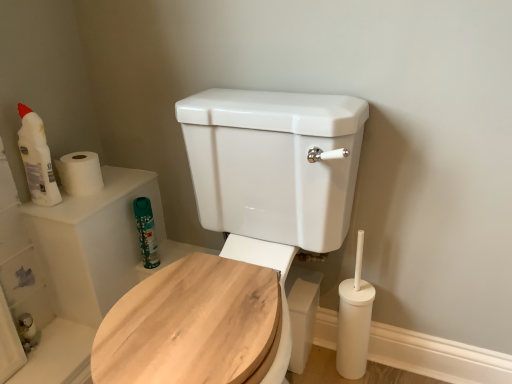
Question: From a real-world perspective, is matte white bottle at upper left, placed as the 2th cleaning product when sorted from right to left, below white matte toilet paper at upper left?

Choices:
 (A) yes
 (B) no

Answer: (B)

Question: Would you say white matte toilet paper at upper left is part of matte white bottle at upper left, which is counted as the second cleaning product, starting from the bottom,'s contents?

Choices:
 (A) no
 (B) yes

Answer: (A)

Question: Does matte white bottle at upper left, placed as the 2th cleaning product when sorted from right to left, have a greater width compared to white matte toilet paper at upper left?

Choices:
 (A) yes
 (B) no

Answer: (B)

Question: From the image's perspective, is matte white bottle at upper left, placed as the 1th cleaning product when sorted from front to back, on top of white matte toilet paper at upper left?

Choices:
 (A) yes
 (B) no

Answer: (A)

Question: Does matte white bottle at upper left, which is counted as the second cleaning product, starting from the bottom, have a smaller size compared to white matte toilet paper at upper left?

Choices:
 (A) no
 (B) yes

Answer: (A)

Question: Which is correct: green matte canister at upper left, the 2th cleaning product viewed from the left, is inside wooden toilet seat at center, or outside of it?

Choices:
 (A) inside
 (B) outside

Answer: (B)

Question: Considering the positions of green matte canister at upper left, which ranks as the 1th cleaning product in bottom-to-top order, and wooden toilet seat at center in the image, is green matte canister at upper left, which ranks as the 1th cleaning product in bottom-to-top order, taller or shorter than wooden toilet seat at center?

Choices:
 (A) short
 (B) tall

Answer: (A)

Question: Considering the positions of point (150, 261) and point (119, 352), is point (150, 261) closer or farther from the camera than point (119, 352)?

Choices:
 (A) farther
 (B) closer

Answer: (A)

Question: Is green matte canister at upper left, the 2th cleaning product in the top-to-bottom sequence, wider or thinner than wooden toilet seat at center?

Choices:
 (A) wide
 (B) thin

Answer: (B)

Question: Based on their sizes in the image, would you say white matte toilet paper at upper left is bigger or smaller than matte white bottle at upper left, placed as the 2th cleaning product when sorted from right to left?

Choices:
 (A) small
 (B) big

Answer: (A)

Question: Is white matte toilet paper at upper left to the left or to the right of matte white bottle at upper left, the first cleaning product when ordered from top to bottom, in the image?

Choices:
 (A) right
 (B) left

Answer: (A)

Question: From a real-world perspective, relative to matte white bottle at upper left, placed as the 1th cleaning product when sorted from left to right, is white matte toilet paper at upper left vertically above or below?

Choices:
 (A) below
 (B) above

Answer: (A)

Question: Would you say white matte toilet paper at upper left is inside or outside matte white bottle at upper left, which is counted as the second cleaning product, starting from the bottom?

Choices:
 (A) inside
 (B) outside

Answer: (B)

Question: In the image, is wooden toilet seat at center positioned in front of or behind matte white bottle at upper left, which is counted as the second cleaning product, starting from the bottom?

Choices:
 (A) front
 (B) behind

Answer: (A)

Question: From the image's perspective, is wooden toilet seat at center located above or below matte white bottle at upper left, which is counted as the second cleaning product, starting from the bottom?

Choices:
 (A) below
 (B) above

Answer: (A)